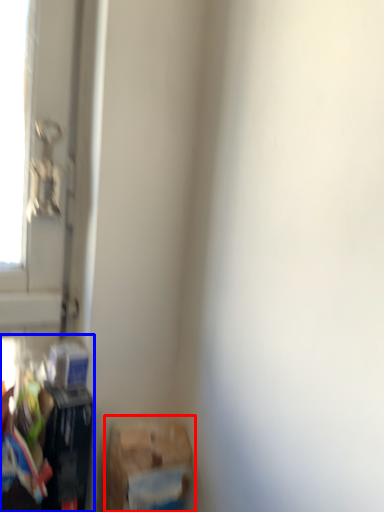
Question: Which object is closer to the camera taking this photo, waste (highlighted by a red box) or waste (highlighted by a blue box)?

Choices:
 (A) waste
 (B) waste

Answer: (A)